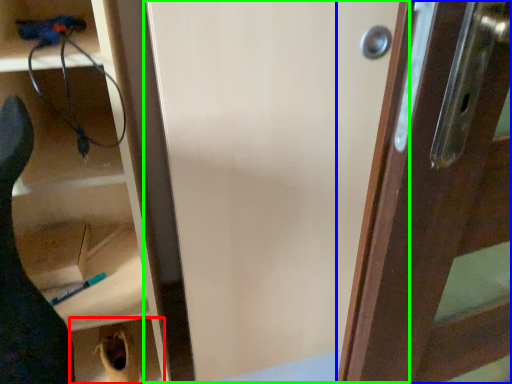
Question: Based on their relative distances, which object is farther from cabinetry (highlighted by a red box)? Choose from wood (highlighted by a blue box) and screen door (highlighted by a green box).

Choices:
 (A) wood
 (B) screen door

Answer: (A)